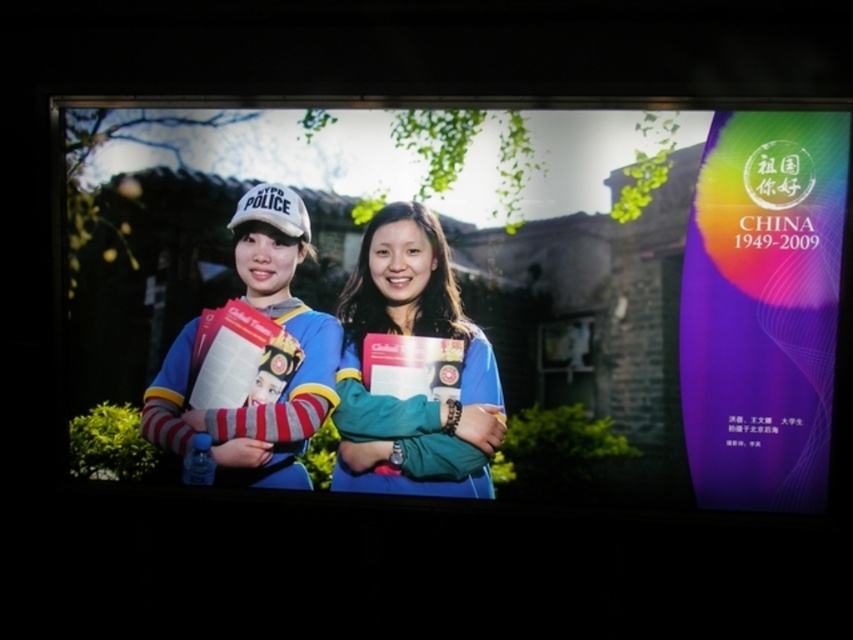
Where is the blue fabric jacket at center located in the image?

The blue fabric jacket at center is located at point (415, 374) in the image.

In the image of the promotional billboard, there are two blue jackets at the center. The first is a blue fabric jacket at center and the second is a matte blue jacket at center. Which one is positioned to the right?

The blue fabric jacket at center is positioned to the right of the matte blue jacket at center.

You are a photographer adjusting the focus on your camera. You want to ensure both the blue fabric jacket at center and the matte blue jacket at center are in focus. Given that your camera has a depth of field that can cover 12 centimeters, will both jackets be in focus?

The blue fabric jacket at center is 12.21 centimeters from the matte blue jacket at center. Since the distance between them exceeds the camera sensor depth of field of 12 centimeters, the jackets may not both be in focus simultaneously.